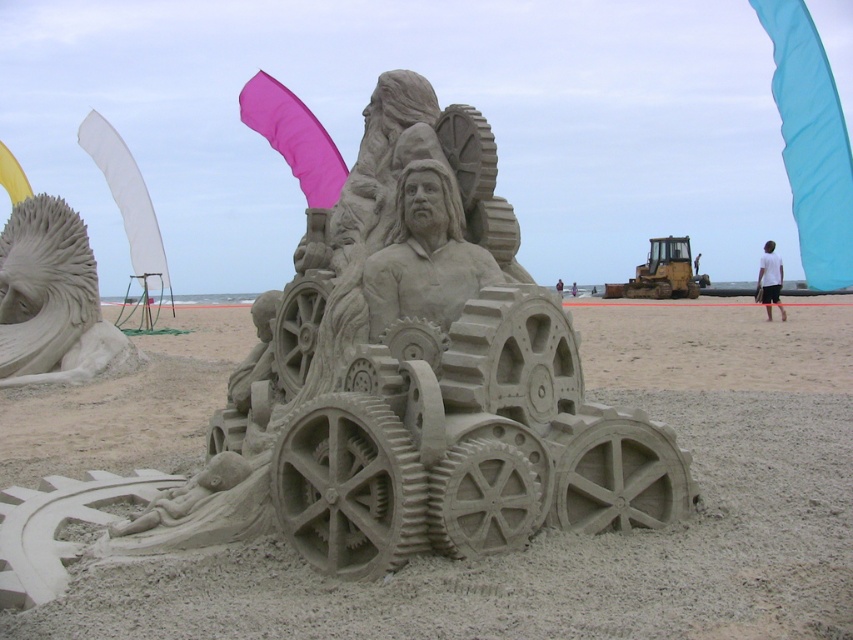
You are a sand sculptor who wants to create a new sculpture between the sandstone gears at center and the smooth sand lion at left. Which existing sculpture should you place your new sculpture closer to so it doesn

The sandstone gears at center is larger than the smooth sand lion at left, so placing the new sculpture closer to the sandstone gears at center would maintain a balanced composition.

You are a tourist standing on the beach and want to take a photo of both the sandstone gears at center and the smooth sand lion at left. Which direction should you face to ensure both are in the frame?

You should face towards the right of the smooth sand lion at left since the sandstone gears at center is to the right of smooth sand lion at left.